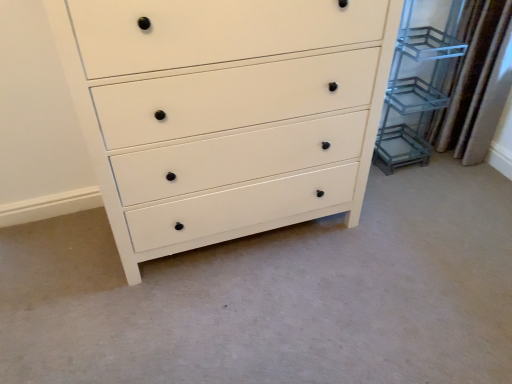
Question: Considering the relative sizes of clear glass shelving unit at right and brown textured curtain at right in the image provided, is clear glass shelving unit at right taller than brown textured curtain at right?

Choices:
 (A) yes
 (B) no

Answer: (A)

Question: Does clear glass shelving unit at right have a lesser height compared to brown textured curtain at right?

Choices:
 (A) yes
 (B) no

Answer: (B)

Question: Does clear glass shelving unit at right have a lesser width compared to brown textured curtain at right?

Choices:
 (A) no
 (B) yes

Answer: (A)

Question: From a real-world perspective, is clear glass shelving unit at right located higher than brown textured curtain at right?

Choices:
 (A) no
 (B) yes

Answer: (B)

Question: From a real-world perspective, is clear glass shelving unit at right located beneath brown textured curtain at right?

Choices:
 (A) no
 (B) yes

Answer: (A)

Question: Is brown textured curtain at right wider or thinner than clear glass shelving unit at right?

Choices:
 (A) wide
 (B) thin

Answer: (B)

Question: Is brown textured curtain at right inside the boundaries of clear glass shelving unit at right, or outside?

Choices:
 (A) inside
 (B) outside

Answer: (B)

Question: From the image's perspective, is brown textured curtain at right above or below clear glass shelving unit at right?

Choices:
 (A) below
 (B) above

Answer: (B)

Question: Is point (497, 48) positioned closer to the camera than point (415, 152)?

Choices:
 (A) farther
 (B) closer

Answer: (B)

Question: Looking at the image, does clear glass shelving unit at right seem bigger or smaller compared to brown textured curtain at right?

Choices:
 (A) big
 (B) small

Answer: (A)

Question: In terms of height, does clear glass shelving unit at right look taller or shorter compared to brown textured curtain at right?

Choices:
 (A) tall
 (B) short

Answer: (A)

Question: Considering the positions of clear glass shelving unit at right and brown textured curtain at right in the image, is clear glass shelving unit at right wider or thinner than brown textured curtain at right?

Choices:
 (A) wide
 (B) thin

Answer: (A)

Question: Visually, is clear glass shelving unit at right positioned to the left or to the right of brown textured curtain at right?

Choices:
 (A) right
 (B) left

Answer: (B)

Question: In terms of height, does clear glass shelving unit at right look taller or shorter compared to white matte chest of drawers at center?

Choices:
 (A) short
 (B) tall

Answer: (A)

Question: Is clear glass shelving unit at right in front of or behind white matte chest of drawers at center in the image?

Choices:
 (A) behind
 (B) front

Answer: (A)